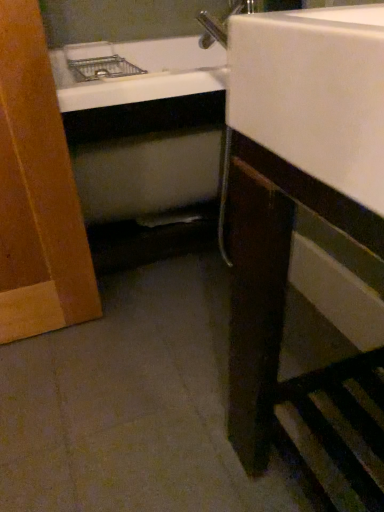
The width and height of the screenshot is (384, 512). In order to click on white glossy cabinet at lower right in this screenshot , I will do `click(281, 303)`.

Measure the distance between point (238, 435) and camera.

The distance of point (238, 435) from camera is 34.37 inches.

Describe the element at coordinates (281, 303) in the screenshot. The image size is (384, 512). I see `white glossy cabinet at lower right` at that location.

Identify the location of white glossy cabinet at lower right. The image size is (384, 512). (281, 303).